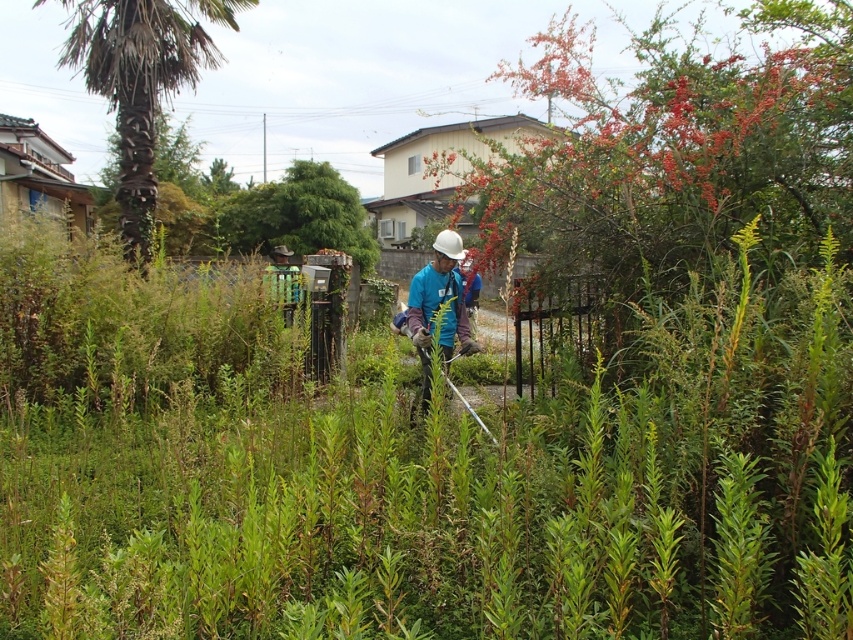
Between green leafy palm at left and blue fabric at center, which one appears on the right side from the viewer's perspective?

blue fabric at center is more to the right.

Does green leafy palm at left have a greater height compared to blue fabric at center?

Yes.

Find the location of a particular element. green leafy palm at left is located at coordinates (141, 80).